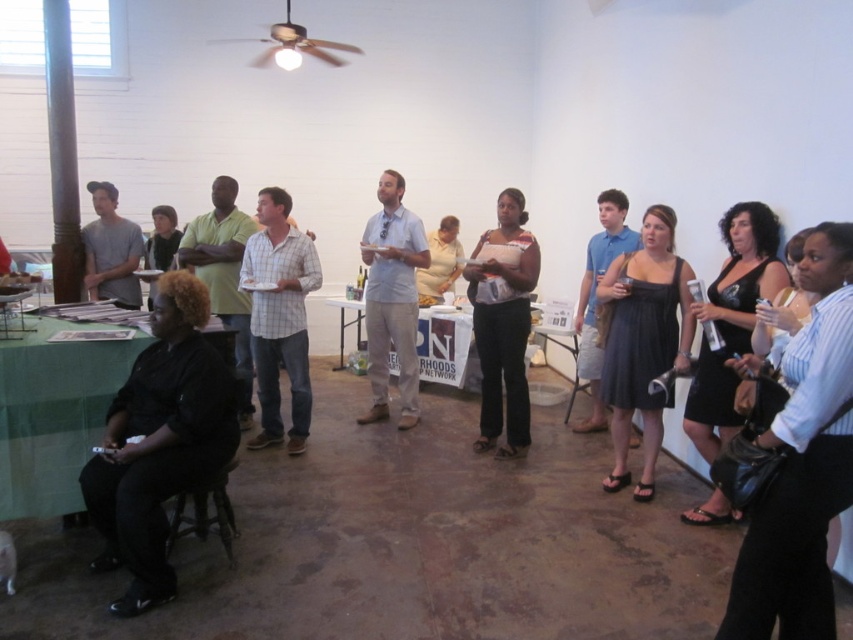
You are organizing a small event and need to place a 1.2 meter wide banner between the green fabric table at lower left and the plaid shirt at center. Can the banner fit between them based on their sizes?

The green fabric table at lower left has a larger size compared to plaid shirt at center. However, the banner requires space between them, not their sizes. The description does not provide the distance between them, so it is impossible to determine if the banner will fit.